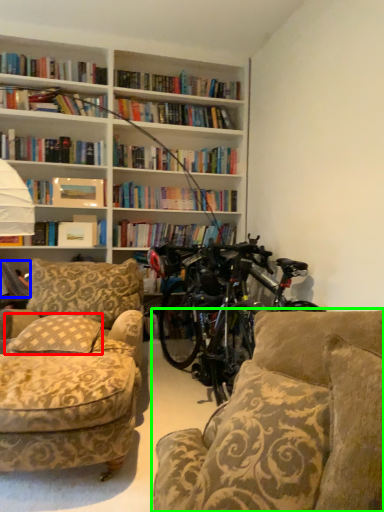
Question: Considering the real-world distances, which object is farthest from pillow (highlighted by a red box)? book (highlighted by a blue box) or studio couch (highlighted by a green box)?

Choices:
 (A) book
 (B) studio couch

Answer: (B)